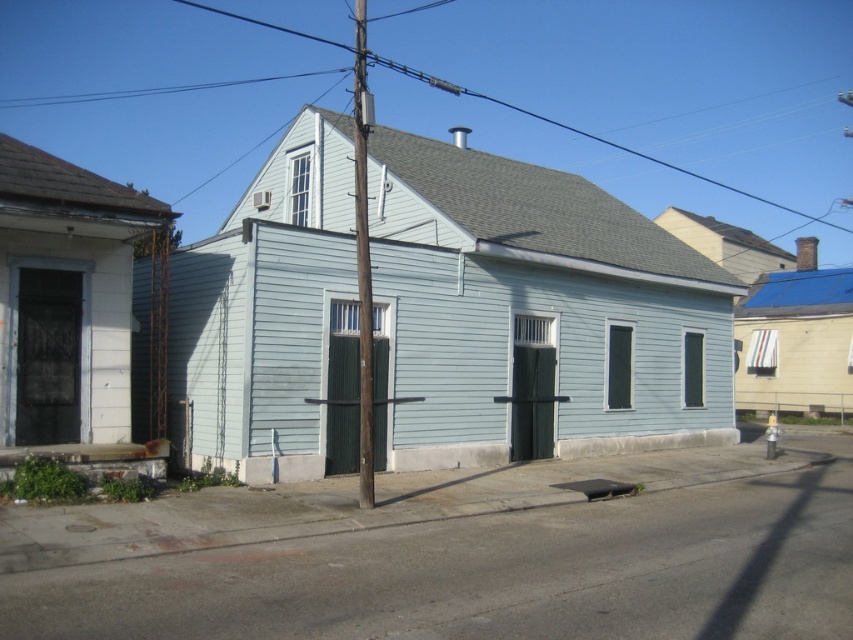
You are a painter standing on the sidewalk in front of the house. You want to paint the brown wooden telegraph pole at center and the gray wire at upper center. Which object should you look to your left to paint first?

The brown wooden telegraph pole at center is to the left of the gray wire at upper center, so you should look to your left to paint the brown wooden telegraph pole at center first.

You are a city planner assessing the safety of the brown wooden telegraph pole at center and the gray wire at upper center. Given that the minimum safe distance between a utility pole and overhead wires is 20 meters, is the current distance compliant with safety standards?

The distance between the brown wooden telegraph pole at center and the gray wire at upper center is 25.53 meters, which exceeds the minimum safe distance requirement of 20 meters. Therefore, the current setup complies with safety standards.